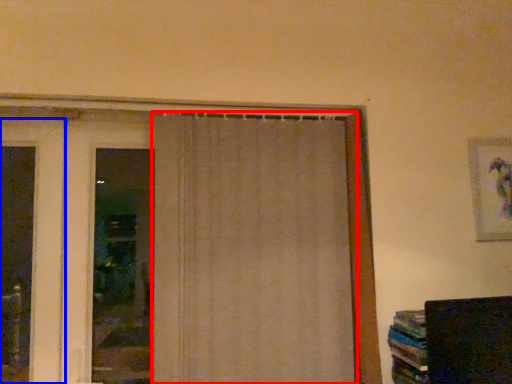
Question: Which object is further to the camera taking this photo, curtain (highlighted by a red box) or door (highlighted by a blue box)?

Choices:
 (A) curtain
 (B) door

Answer: (B)